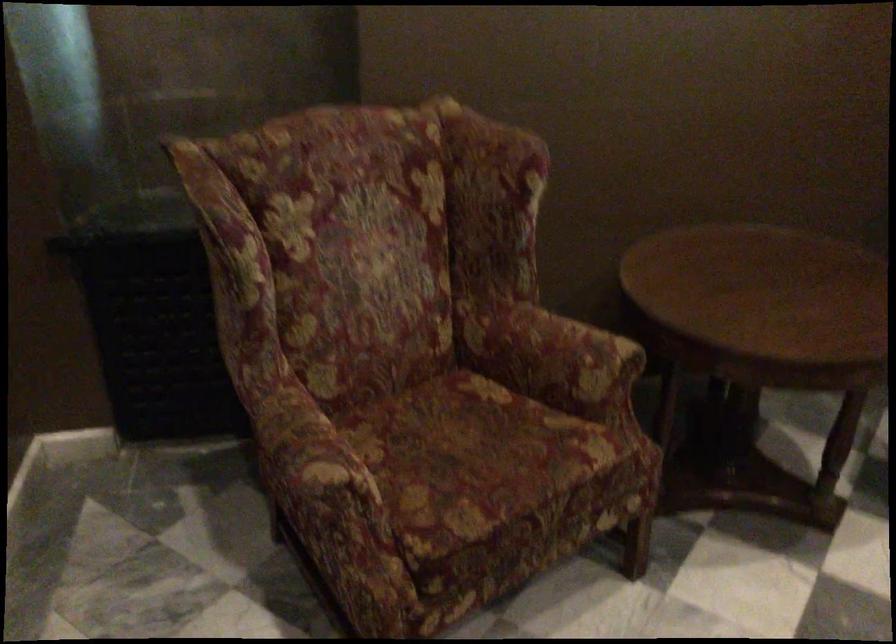
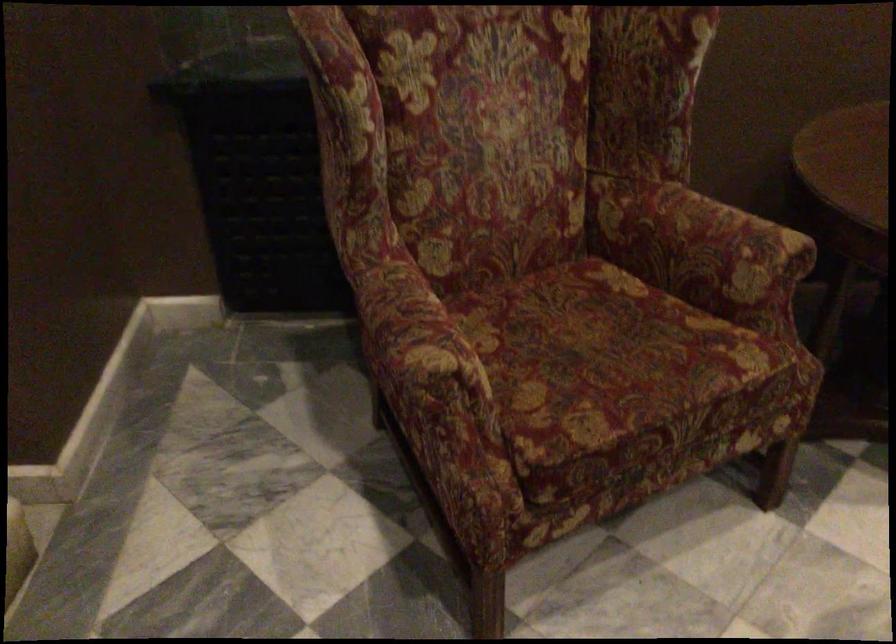
Question: The images are taken continuously from a first-person perspective. In which direction is your viewpoint rotating?

Choices:
 (A) Left
 (B) Right
 (C) Up
 (D) Down

Answer: (D)